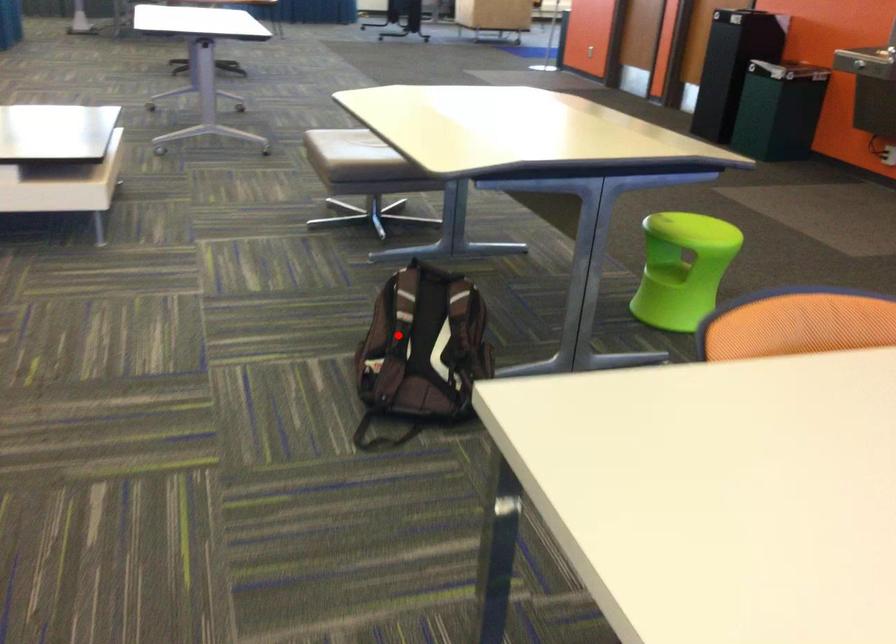
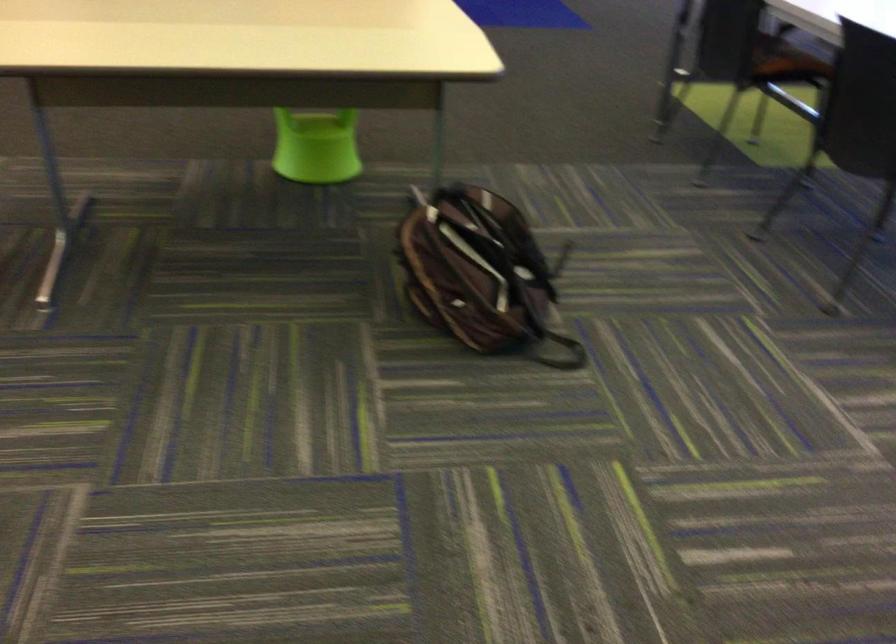
Question: I am providing you with two images of the same scene from different viewpoints. Image1 has a red point marked. In image2, the corresponding 3D location appears at what relative position? Reply with the corresponding letter.

Choices:
 (A) Closer
 (B) Farther

Answer: (A)